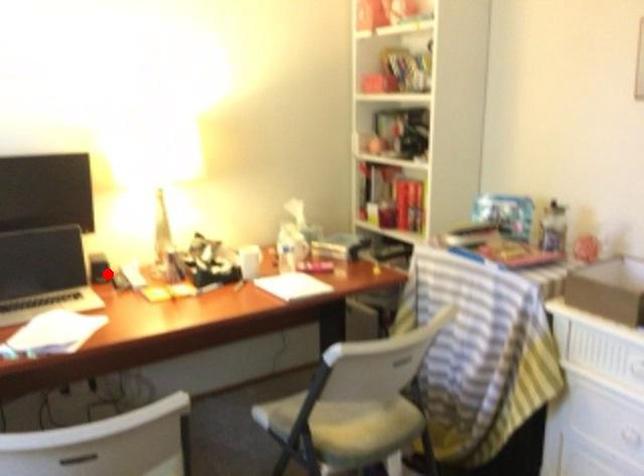
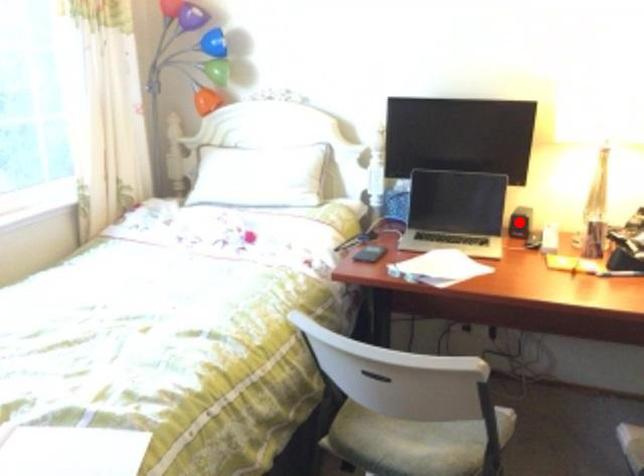
Looking at this image, I am providing you with two images of the same scene from different viewpoints. A red point is marked on the first image and another point is marked on the second image. Is the marked point in image1 the same physical position as the marked point in image2?

Yes